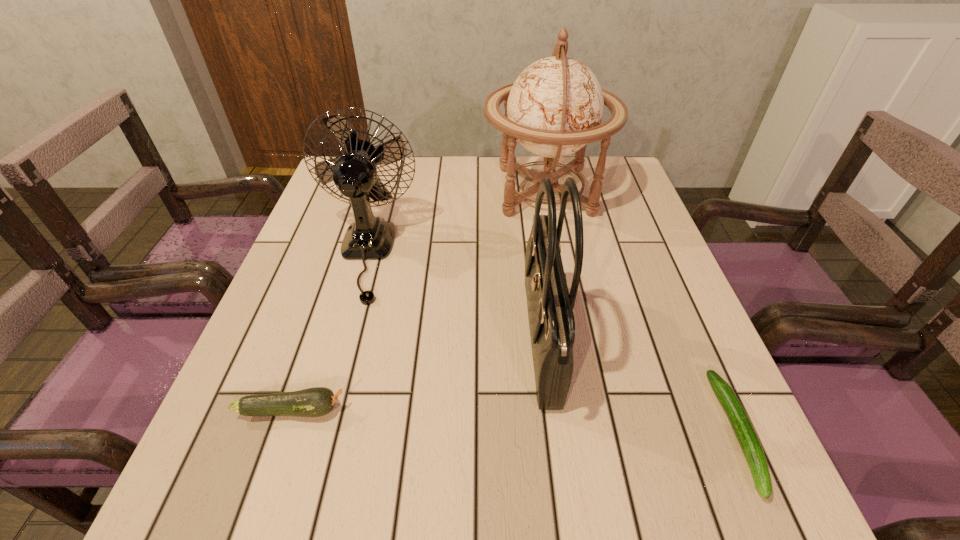
The image size is (960, 540). In order to click on vacant space that satisfies the following two spatial constraints: 1. in front of the fan, indicating the direction of air flow; 2. at the blossom end of the fourth tallest object in this screenshot , I will do `click(322, 410)`.

Image resolution: width=960 pixels, height=540 pixels. Find the location of `blank area in the image that satisfies the following two spatial constraints: 1. at the front of the globe showing Africa; 2. in front of the fan, indicating the direction of air flow`. blank area in the image that satisfies the following two spatial constraints: 1. at the front of the globe showing Africa; 2. in front of the fan, indicating the direction of air flow is located at coordinates (558, 255).

In order to click on free space that satisfies the following two spatial constraints: 1. at the front of the globe showing Africa; 2. in front of the fan, indicating the direction of air flow in this screenshot , I will do `click(558, 255)`.

In order to click on free location that satisfies the following two spatial constraints: 1. at the front of the globe showing Africa; 2. in front of the fan, indicating the direction of air flow in this screenshot , I will do `click(558, 255)`.

Where is `free space that satisfies the following two spatial constraints: 1. in front of the fan, indicating the direction of air flow; 2. at the blossom end of the taller zucchini`? This screenshot has width=960, height=540. free space that satisfies the following two spatial constraints: 1. in front of the fan, indicating the direction of air flow; 2. at the blossom end of the taller zucchini is located at coordinates (322, 410).